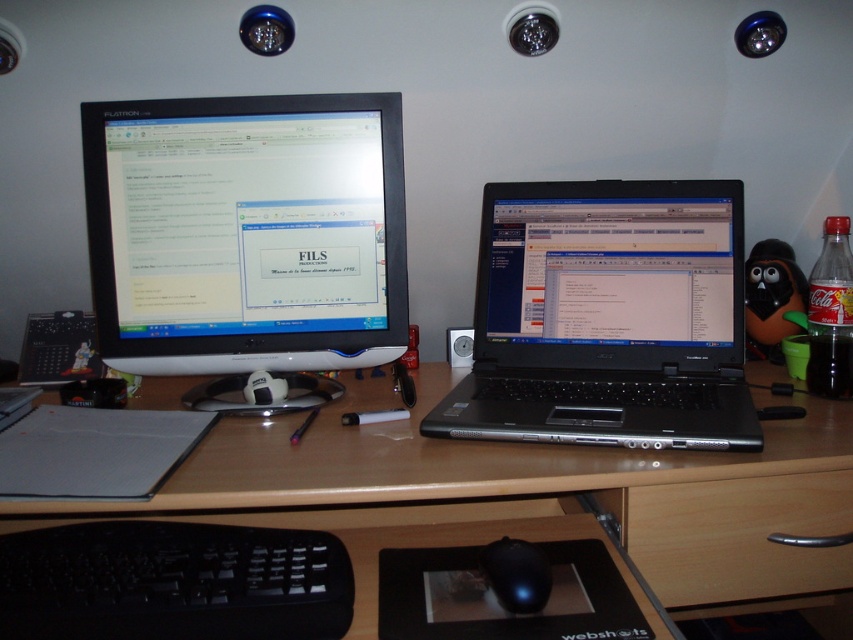
Question: Can you confirm if wooden at center is positioned to the right of black plastic laptop at center?

Choices:
 (A) no
 (B) yes

Answer: (A)

Question: Which of the following is the closest to the observer?

Choices:
 (A) (126, 209)
 (B) (605, 605)
 (C) (93, 573)
 (D) (714, 547)

Answer: (C)

Question: Is wooden at lower right wider than black glossy mouse at center?

Choices:
 (A) yes
 (B) no

Answer: (A)

Question: Which object is farther from the camera taking this photo?

Choices:
 (A) wooden at lower right
 (B) wooden at center

Answer: (A)

Question: Does satin black monitor at upper left have a smaller size compared to black glossy mouse at center?

Choices:
 (A) no
 (B) yes

Answer: (A)

Question: Which of these objects is positioned closest to the black matte mouse at center?

Choices:
 (A) black plastic keyboard at lower left
 (B) black plastic laptop at center

Answer: (A)